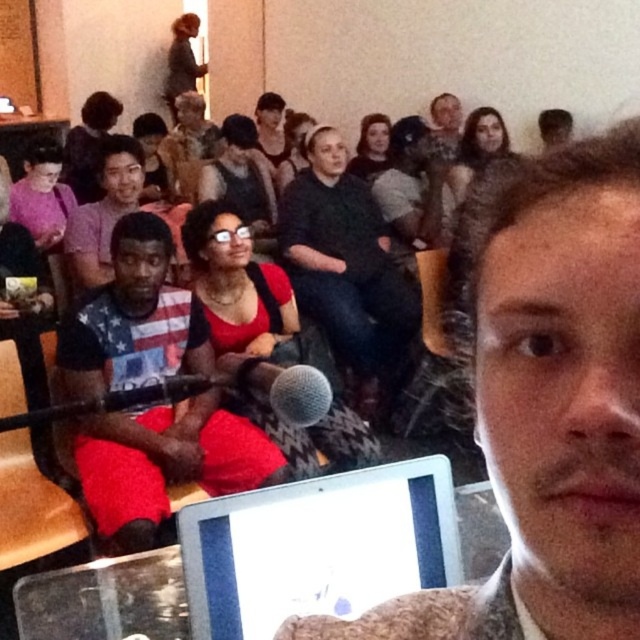
Question: Observing the image, what is the correct spatial positioning of silver metallic laptop at center in reference to silver metallic microphone at center?

Choices:
 (A) below
 (B) above

Answer: (A)

Question: Which object appears farthest from the camera in this image?

Choices:
 (A) american flag t-shirt at center
 (B) silver metallic microphone at center
 (C) silver metallic laptop at center
 (D) smooth brown hair at center

Answer: (D)

Question: Can you confirm if silver metallic laptop at center is smaller than dark gray sweater at center?

Choices:
 (A) yes
 (B) no

Answer: (A)

Question: Is matte black shirt at center positioned in front of silver metallic microphone at center?

Choices:
 (A) yes
 (B) no

Answer: (B)

Question: Which point is closer to the camera?

Choices:
 (A) (144, 504)
 (B) (634, 220)
 (C) (90, 276)

Answer: (B)

Question: Among these objects, which one is nearest to the camera?

Choices:
 (A) dark gray sweater at center
 (B) silver metallic laptop at center
 (C) smooth brown hair at center

Answer: (B)